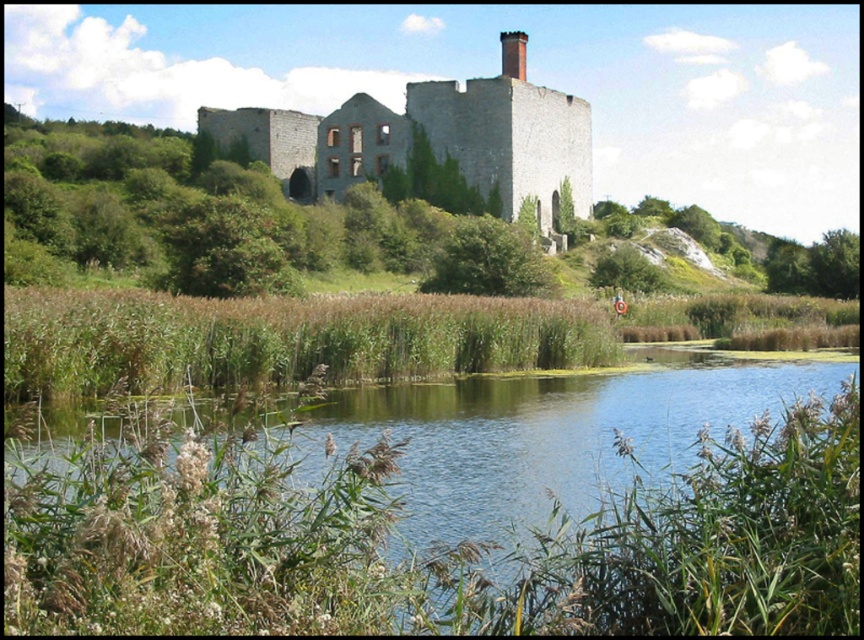
Question: Which of the following is the closest to the observer?

Choices:
 (A) (269, 529)
 (B) (287, 182)

Answer: (A)

Question: From the image, what is the correct spatial relationship of green grassy river at center in relation to gray stone castle at center?

Choices:
 (A) right
 (B) left

Answer: (A)

Question: Which object appears closest to the camera in this image?

Choices:
 (A) green grassy river at center
 (B) gray stone castle at center

Answer: (A)

Question: Which of the following is the closest to the observer?

Choices:
 (A) green grassy river at center
 (B) gray stone castle at center

Answer: (A)

Question: Can you confirm if green grassy river at center is positioned below gray stone castle at center?

Choices:
 (A) yes
 (B) no

Answer: (A)

Question: Is green grassy river at center to the right of gray stone castle at center from the viewer's perspective?

Choices:
 (A) no
 (B) yes

Answer: (B)